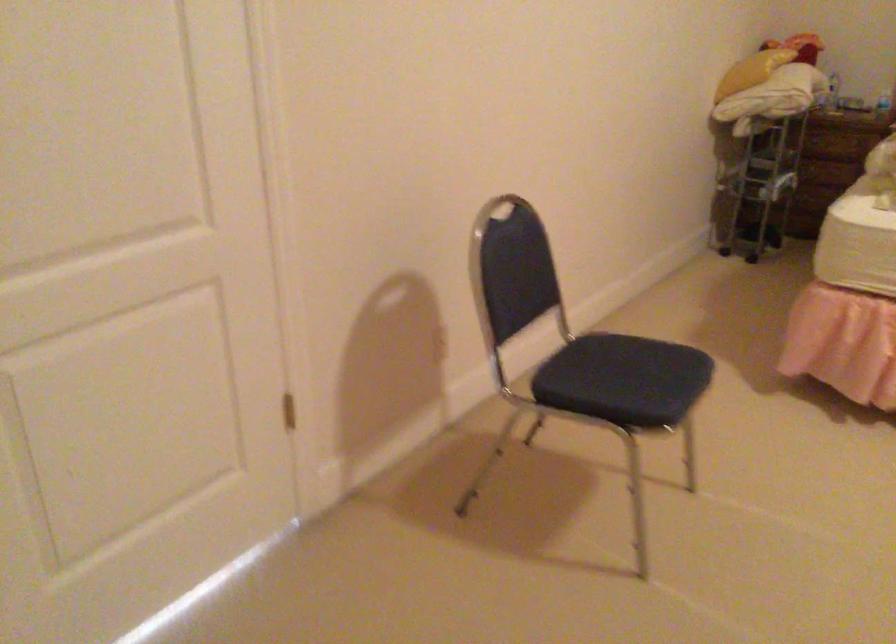
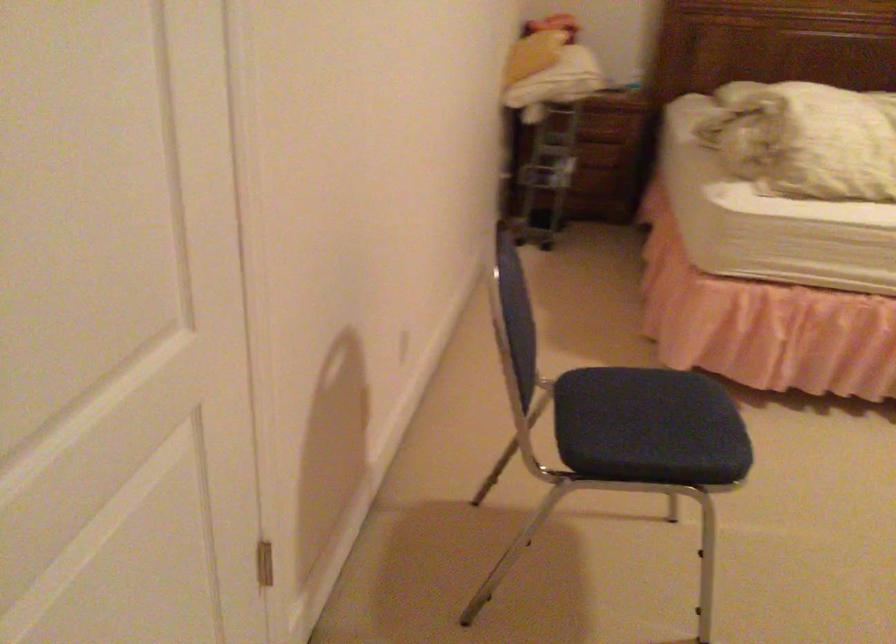
Locate, in the second image, the point that corresponds to the point at 604,381 in the first image.

(650, 433)